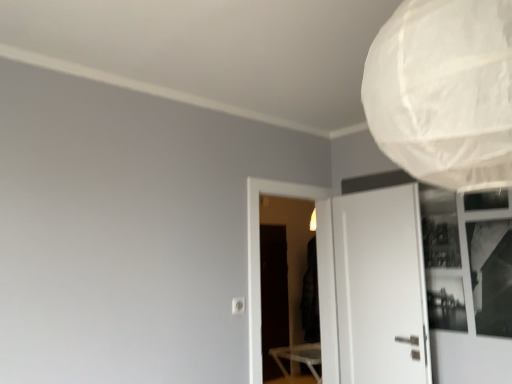
This screenshot has width=512, height=384. I want to click on black glass window at upper right, so click(x=490, y=275).

Describe the element at coordinates (381, 287) in the screenshot. I see `white matte door at right` at that location.

This screenshot has height=384, width=512. What do you see at coordinates (444, 92) in the screenshot?
I see `white paper lampshade at upper right` at bounding box center [444, 92].

Where is `white paper lampshade at upper right`? The height and width of the screenshot is (384, 512). white paper lampshade at upper right is located at coordinates (444, 92).

This screenshot has height=384, width=512. I want to click on black matte screen door at center, the first screen door positioned from the back, so click(x=273, y=296).

Which object is closer to the camera taking this photo, white matte door at right or white paper lampshade at upper right?

white paper lampshade at upper right is in front.

Considering the relative sizes of white matte door at right and white paper lampshade at upper right in the image provided, is white matte door at right taller than white paper lampshade at upper right?

Yes, white matte door at right is taller than white paper lampshade at upper right.

From the picture: From a real-world perspective, is white matte door at right on top of white paper lampshade at upper right?

Actually, white matte door at right is physically below white paper lampshade at upper right in the real world.

Between white matte door at right and white paper lampshade at upper right, which one has larger size?

white matte door at right.

Which object is thinner, black glass window at upper right or black matte screen door at center, the 2th screen door when ordered from front to back?

Thinner between the two is black glass window at upper right.

Considering the positions of point (485, 273) and point (278, 343), is point (485, 273) closer or farther from the camera than point (278, 343)?

Point (485, 273).

Does black glass window at upper right turn towards black matte screen door at center, the 2th screen door when ordered from front to back?

No, black glass window at upper right is not aimed at black matte screen door at center, the 2th screen door when ordered from front to back.

Which object is further away from the camera, black glass window at upper right or black matte screen door at center, the first screen door positioned from the back?

black matte screen door at center, the first screen door positioned from the back, is further away from the camera.

From the picture: Is white paper lampshade at upper right positioned beyond the bounds of black matte screen door at center, the 2th screen door when ordered from front to back?

Yes, white paper lampshade at upper right is outside of black matte screen door at center, the 2th screen door when ordered from front to back.

Looking at this image, how different are the orientations of white paper lampshade at upper right and black matte screen door at center, the first screen door positioned from the back, in degrees?

The facing directions of white paper lampshade at upper right and black matte screen door at center, the first screen door positioned from the back, are 180 degrees apart.

Is white paper lampshade at upper right next to black matte screen door at center, the first screen door positioned from the back?

No, white paper lampshade at upper right is not beside black matte screen door at center, the first screen door positioned from the back.

Is white paper lampshade at upper right facing towards transparent plastic screen door at center, acting as the 1th screen door starting from the front?

No, white paper lampshade at upper right does not turn towards transparent plastic screen door at center, acting as the 1th screen door starting from the front.

Who is shorter, white paper lampshade at upper right or transparent plastic screen door at center, which is counted as the second screen door, starting from the back?

Standing shorter between the two is white paper lampshade at upper right.

Between white paper lampshade at upper right and transparent plastic screen door at center, which is counted as the second screen door, starting from the back, which one appears on the right side from the viewer's perspective?

From the viewer's perspective, white paper lampshade at upper right appears more on the right side.

The height and width of the screenshot is (384, 512). I want to click on door on the left of the black glass window at upper right, so click(x=381, y=287).

Can you tell me how much white matte door at right and black glass window at upper right differ in facing direction?

They differ by 10.5 degrees in their facing directions.

Between point (350, 321) and point (482, 234), which one is positioned in front?

Point (482, 234)

Is the surface of transparent plastic screen door at center, acting as the 1th screen door starting from the front, in direct contact with white paper lampshade at upper right?

No, transparent plastic screen door at center, acting as the 1th screen door starting from the front, is not with white paper lampshade at upper right.

Which is behind, transparent plastic screen door at center, which is counted as the second screen door, starting from the back, or white paper lampshade at upper right?

transparent plastic screen door at center, which is counted as the second screen door, starting from the back, is behind.

In the image, is transparent plastic screen door at center, which is counted as the second screen door, starting from the back, on the left side or the right side of white paper lampshade at upper right?

From the image, it's evident that transparent plastic screen door at center, which is counted as the second screen door, starting from the back, is to the left of white paper lampshade at upper right.

Could transparent plastic screen door at center, which is counted as the second screen door, starting from the back, be considered to be inside black matte screen door at center, the first screen door positioned from the back?

No, transparent plastic screen door at center, which is counted as the second screen door, starting from the back, is not a part of black matte screen door at center, the first screen door positioned from the back.

Identify the location of screen door above the black matte screen door at center, the first screen door positioned from the back (from a real-world perspective). (283, 275).

From a real-world perspective, who is located higher, black matte screen door at center, the 2th screen door when ordered from front to back, or transparent plastic screen door at center, which is counted as the second screen door, starting from the back?

transparent plastic screen door at center, which is counted as the second screen door, starting from the back, is physically above.

Can you confirm if black matte screen door at center, the first screen door positioned from the back, is thinner than transparent plastic screen door at center, acting as the 1th screen door starting from the front?

Yes, black matte screen door at center, the first screen door positioned from the back, is thinner than transparent plastic screen door at center, acting as the 1th screen door starting from the front.

This screenshot has height=384, width=512. Identify the location of lamp above the white matte door at right (from the image's perspective). click(x=444, y=92).

Image resolution: width=512 pixels, height=384 pixels. Find the location of `window on the right of black matte screen door at center, the 2th screen door when ordered from front to back`. window on the right of black matte screen door at center, the 2th screen door when ordered from front to back is located at coordinates (490, 275).

Based on their spatial positions, is white paper lampshade at upper right or black glass window at upper right further from transparent plastic screen door at center, which is counted as the second screen door, starting from the back?

The object further to transparent plastic screen door at center, which is counted as the second screen door, starting from the back, is white paper lampshade at upper right.

Estimate the real-world distances between objects in this image. Which object is closer to white paper lampshade at upper right, white matte door at right or black matte screen door at center, the 2th screen door when ordered from front to back?

The object closer to white paper lampshade at upper right is white matte door at right.

Estimate the real-world distances between objects in this image. Which object is closer to white paper lampshade at upper right, transparent plastic screen door at center, which is counted as the second screen door, starting from the back, or black matte screen door at center, the 2th screen door when ordered from front to back?

black matte screen door at center, the 2th screen door when ordered from front to back, lies closer to white paper lampshade at upper right than the other object.

When comparing their distances from black matte screen door at center, the 2th screen door when ordered from front to back, does transparent plastic screen door at center, acting as the 1th screen door starting from the front, or white matte door at right seem closer?

transparent plastic screen door at center, acting as the 1th screen door starting from the front, lies closer to black matte screen door at center, the 2th screen door when ordered from front to back, than the other object.

Estimate the real-world distances between objects in this image. Which object is closer to black matte screen door at center, the 2th screen door when ordered from front to back, white paper lampshade at upper right or black glass window at upper right?

black glass window at upper right lies closer to black matte screen door at center, the 2th screen door when ordered from front to back, than the other object.

From the image, which object appears to be nearer to black glass window at upper right, black matte screen door at center, the 2th screen door when ordered from front to back, or white matte door at right?

white matte door at right is positioned closer to the anchor black glass window at upper right.

Based on the photo, considering their positions, is transparent plastic screen door at center, acting as the 1th screen door starting from the front, positioned closer to white matte door at right than white paper lampshade at upper right?

white paper lampshade at upper right is closer to white matte door at right.

Consider the image. Estimate the real-world distances between objects in this image. Which object is further from black glass window at upper right, white paper lampshade at upper right or white matte door at right?

white paper lampshade at upper right is further to black glass window at upper right.

Find the location of a particular element. The width and height of the screenshot is (512, 384). screen door between white matte door at right and black matte screen door at center, the first screen door positioned from the back, in the front-back direction is located at coordinates 283,275.

Where is `screen door located between white paper lampshade at upper right and black matte screen door at center, the 2th screen door when ordered from front to back, in the depth direction`? The height and width of the screenshot is (384, 512). screen door located between white paper lampshade at upper right and black matte screen door at center, the 2th screen door when ordered from front to back, in the depth direction is located at coordinates (283, 275).

This screenshot has width=512, height=384. Identify the location of screen door between black glass window at upper right and black matte screen door at center, the 2th screen door when ordered from front to back, from front to back. (283, 275).

Image resolution: width=512 pixels, height=384 pixels. In order to click on door between black glass window at upper right and black matte screen door at center, the 2th screen door when ordered from front to back, along the z-axis in this screenshot , I will do `click(381, 287)`.